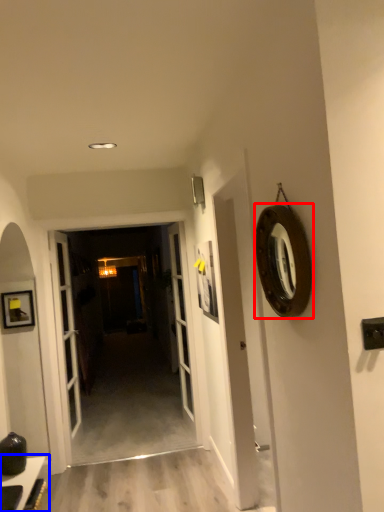
Question: Which object is further to the camera taking this photo, oval (highlighted by a red box) or table (highlighted by a blue box)?

Choices:
 (A) oval
 (B) table

Answer: (B)